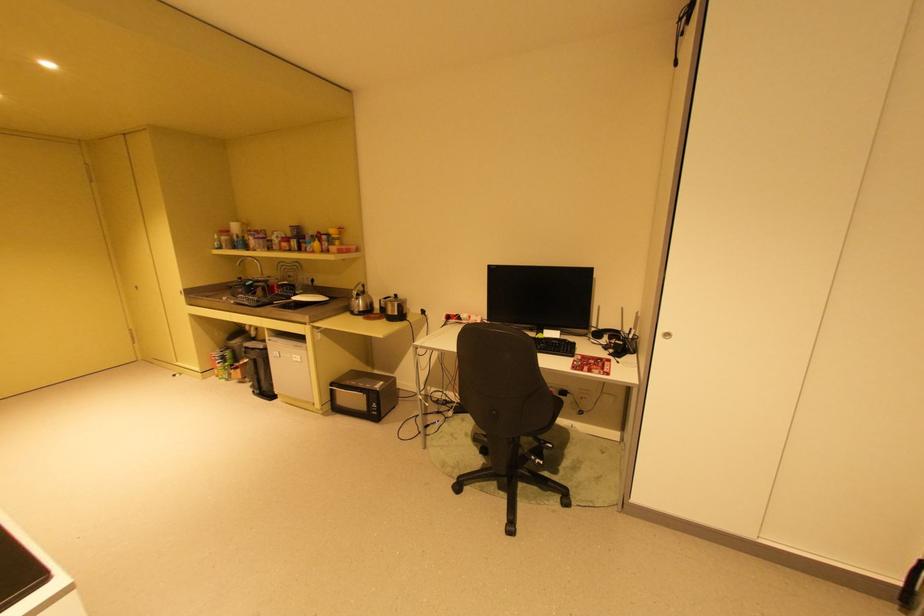
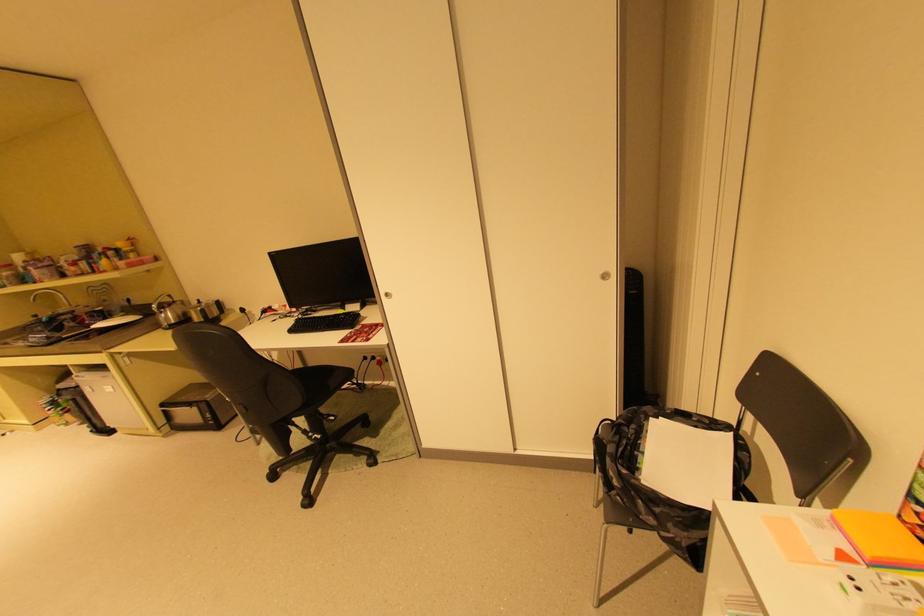
In the second image, find the point that corresponds to point 374,306 in the first image.

(187, 317)